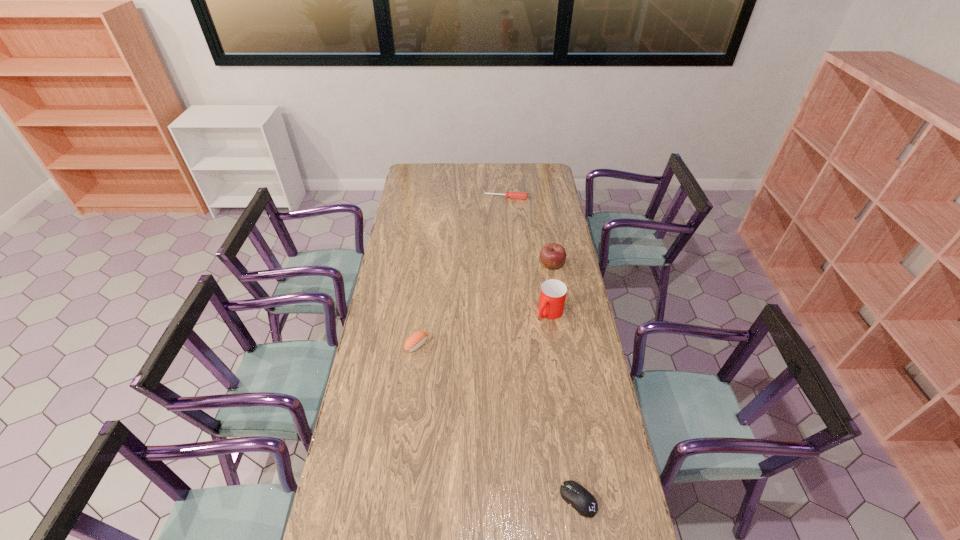
At what (x,y) coordinates should I click in order to perform the action: click on vacant space on the desktop that is between the leftmost object and the nearest object and is positioned on the side of the third nearest object with the handle. Please return your answer as a coordinate pair (x, y). Looking at the image, I should click on (471, 397).

Where is `free space on the desktop that is between the leftmost object and the nearest object and is positioned on the side of the second tallest object with the unique marking`? The width and height of the screenshot is (960, 540). free space on the desktop that is between the leftmost object and the nearest object and is positioned on the side of the second tallest object with the unique marking is located at coordinates (466, 391).

You are a GUI agent. You are given a task and a screenshot of the screen. Output one action in this format:
    pyautogui.click(x=<x>, y=<y>)
    Task: Click on the vacant spot on the desktop that is between the third tallest object and the nearest object and is positioned at the blade of the screwdriver
    
    Given the screenshot: What is the action you would take?
    478,403